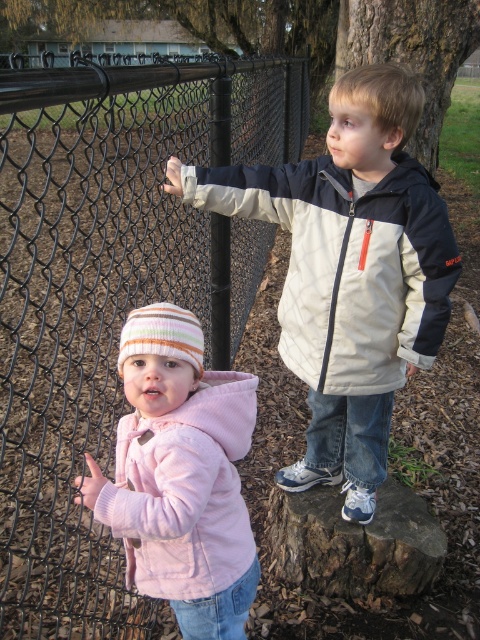
Looking at this image, which is above, black chain-link fence at left or brown rough tree stump at lower center?

Positioned higher is black chain-link fence at left.

Who is more forward, (233, 346) or (387, 579)?

Point (387, 579) is in front.

The width and height of the screenshot is (480, 640). Identify the location of black chain-link fence at left. (109, 291).

Can you confirm if light beige jacket at upper right is wider than brown rough tree stump at lower center?

Correct, the width of light beige jacket at upper right exceeds that of brown rough tree stump at lower center.

Between point (335, 344) and point (297, 577), which one is positioned behind?

The point (297, 577) is more distant.

You are a GUI agent. You are given a task and a screenshot of the screen. Output one action in this format:
    pyautogui.click(x=<x>, y=<y>)
    Task: Click on the light beige jacket at upper right
    The image size is (480, 640).
    Given the screenshot: What is the action you would take?
    pyautogui.click(x=348, y=266)

Does black chain-link fence at left appear over pink fleece jacket at lower left?

Indeed, black chain-link fence at left is positioned over pink fleece jacket at lower left.

Does black chain-link fence at left have a lesser height compared to pink fleece jacket at lower left?

No.

Where is `black chain-link fence at left`? black chain-link fence at left is located at coordinates click(x=109, y=291).

Locate an element on the screen. black chain-link fence at left is located at coordinates point(109,291).